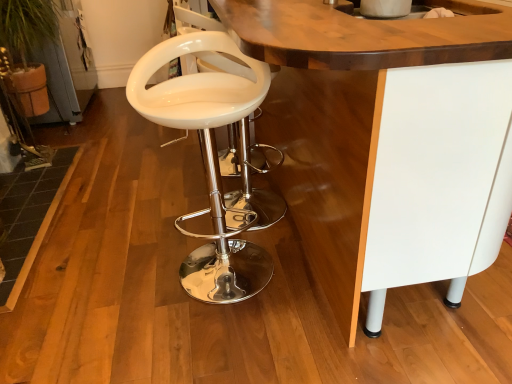
Question: Can you confirm if white glossy table at center is wider than white glossy sink at upper center?

Choices:
 (A) no
 (B) yes

Answer: (B)

Question: Does white glossy table at center turn towards white glossy sink at upper center?

Choices:
 (A) no
 (B) yes

Answer: (A)

Question: Considering the relative sizes of white glossy table at center and white glossy sink at upper center in the image provided, is white glossy table at center bigger than white glossy sink at upper center?

Choices:
 (A) yes
 (B) no

Answer: (A)

Question: From a real-world perspective, is white glossy table at center located beneath white glossy sink at upper center?

Choices:
 (A) no
 (B) yes

Answer: (B)

Question: Does white glossy table at center lie behind white glossy sink at upper center?

Choices:
 (A) yes
 (B) no

Answer: (B)

Question: Considering the relative sizes of white glossy table at center and white glossy sink at upper center in the image provided, is white glossy table at center smaller than white glossy sink at upper center?

Choices:
 (A) no
 (B) yes

Answer: (A)

Question: Is white glossy table at center bigger than white glossy bar stool at center?

Choices:
 (A) yes
 (B) no

Answer: (A)

Question: From a real-world perspective, is white glossy table at center physically above white glossy bar stool at center?

Choices:
 (A) no
 (B) yes

Answer: (B)

Question: Is white glossy table at center in contact with white glossy bar stool at center?

Choices:
 (A) no
 (B) yes

Answer: (A)

Question: Is white glossy table at center not within white glossy bar stool at center?

Choices:
 (A) no
 (B) yes

Answer: (B)

Question: Are white glossy table at center and white glossy bar stool at center far apart?

Choices:
 (A) no
 (B) yes

Answer: (A)

Question: Could you tell me if white glossy table at center is facing white glossy bar stool at center?

Choices:
 (A) no
 (B) yes

Answer: (B)

Question: Can you confirm if white glossy bar stool at center is positioned to the right of white glossy sink at upper center?

Choices:
 (A) yes
 (B) no

Answer: (B)